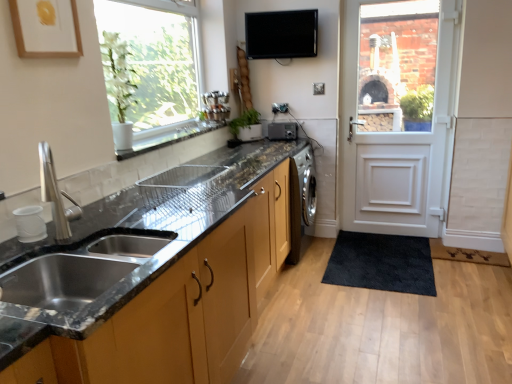
Question: Based on their sizes in the image, would you say black glossy tv at upper center, positioned as the 2th appliance in back-to-front order, is bigger or smaller than matte brown cabinets at lower left, acting as the first cabinetry starting from the bottom?

Choices:
 (A) small
 (B) big

Answer: (A)

Question: Considering the positions of black glossy tv at upper center, which is counted as the 1th appliance, starting from the front, and matte brown cabinets at lower left, which appears as the second cabinetry when viewed from the top, in the image, is black glossy tv at upper center, which is counted as the 1th appliance, starting from the front, wider or thinner than matte brown cabinets at lower left, which appears as the second cabinetry when viewed from the top,?

Choices:
 (A) thin
 (B) wide

Answer: (A)

Question: Which object is positioned closest to the matte black sink at lower left, arranged as the second cabinetry when ordered from the bottom?

Choices:
 (A) white ceramic window sill at upper center
 (B) white wooden door at right
 (C) clear glass window at upper left
 (D) dark brown textured mat at lower right
 (E) black glossy tv at upper center, positioned as the 2th appliance in back-to-front order

Answer: (A)

Question: Which object is the closest to the satin silver washing machine at right, marked as the 1th appliance in a back-to-front arrangement?

Choices:
 (A) green matte plant at center
 (B) matte brown cabinets at lower left, acting as the first cabinetry starting from the bottom
 (C) white ceramic window sill at upper center
 (D) dark brown textured mat at lower right
 (E) clear glass window at upper left

Answer: (A)